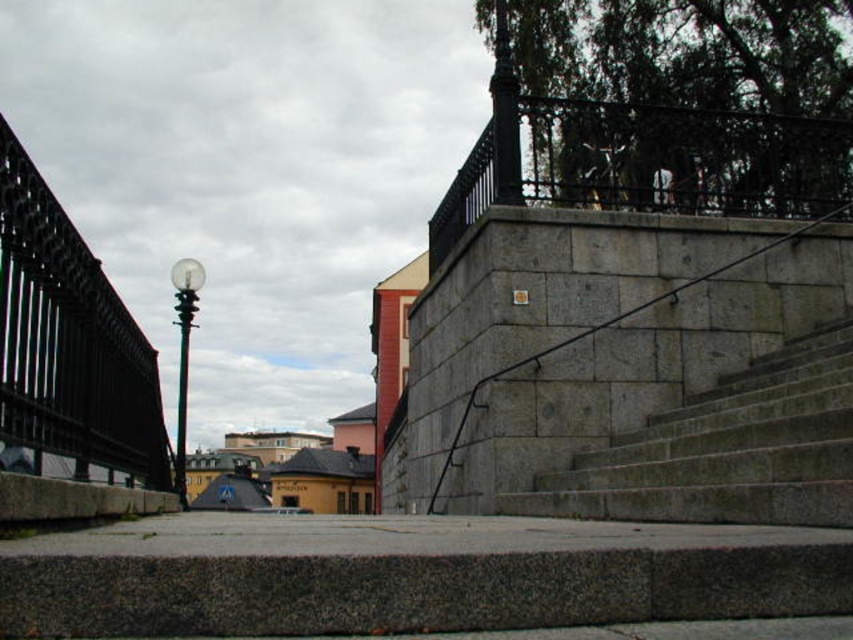
Is gray stone steps at center taller than gray stone stairs at center?

In fact, gray stone steps at center may be shorter than gray stone stairs at center.

Which is behind, point (563, 324) or point (612, 467)?

Positioned behind is point (563, 324).

You are a GUI agent. You are given a task and a screenshot of the screen. Output one action in this format:
    pyautogui.click(x=<x>, y=<y>)
    Task: Click on the gray stone steps at center
    
    Given the screenshot: What is the action you would take?
    tap(587, 337)

Is gray concrete at lower center positioned behind gray stone stairs at center?

No, gray concrete at lower center is in front of gray stone stairs at center.

Is point (747, 595) farther from viewer compared to point (833, 371)?

No, it is in front of (833, 371).

Locate an element on the screen. The width and height of the screenshot is (853, 640). gray concrete at lower center is located at coordinates (409, 573).

Which is in front, point (811, 296) or point (229, 596)?

Point (229, 596)

Measure the distance between point (697, 280) and camera.

They are 7.20 meters apart.

I want to click on gray stone steps at center, so click(587, 337).